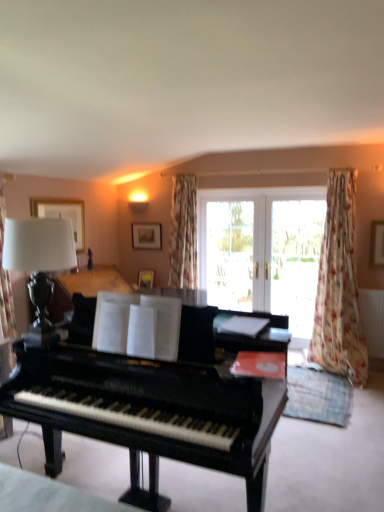
Question: Does white glass doors at center have a greater width compared to transparent glass screen door at center, which is counted as the first screen door, starting from the right?

Choices:
 (A) no
 (B) yes

Answer: (A)

Question: Is the position of white glass doors at center more distant than that of transparent glass screen door at center, the 2th screen door positioned from the left?

Choices:
 (A) yes
 (B) no

Answer: (A)

Question: From the image's perspective, would you say white glass doors at center is positioned over transparent glass screen door at center, which is counted as the first screen door, starting from the right?

Choices:
 (A) no
 (B) yes

Answer: (B)

Question: Can you confirm if white glass doors at center is smaller than transparent glass screen door at center, which is counted as the first screen door, starting from the right?

Choices:
 (A) no
 (B) yes

Answer: (A)

Question: Can you confirm if white glass doors at center is positioned to the right of transparent glass screen door at center, the 2th screen door positioned from the left?

Choices:
 (A) yes
 (B) no

Answer: (B)

Question: Visually, is floral fabric curtain at right positioned to the left or to the right of matte black lamp at left?

Choices:
 (A) right
 (B) left

Answer: (A)

Question: In terms of height, does floral fabric curtain at right look taller or shorter compared to matte black lamp at left?

Choices:
 (A) short
 (B) tall

Answer: (B)

Question: Do you think floral fabric curtain at right is within matte black lamp at left, or outside of it?

Choices:
 (A) outside
 (B) inside

Answer: (A)

Question: Based on their sizes in the image, would you say floral fabric curtain at right is bigger or smaller than matte black lamp at left?

Choices:
 (A) big
 (B) small

Answer: (A)

Question: From the image's perspective, is shiny black piano at center positioned above or below white glass doors at center?

Choices:
 (A) below
 (B) above

Answer: (A)

Question: Is point (135, 417) positioned closer to the camera than point (230, 219)?

Choices:
 (A) farther
 (B) closer

Answer: (B)

Question: Considering the positions of shiny black piano at center and white glass doors at center in the image, is shiny black piano at center taller or shorter than white glass doors at center?

Choices:
 (A) short
 (B) tall

Answer: (A)

Question: In terms of size, does shiny black piano at center appear bigger or smaller than white glass doors at center?

Choices:
 (A) small
 (B) big

Answer: (B)

Question: Does point (324, 338) appear closer or farther from the camera than point (299, 330)?

Choices:
 (A) farther
 (B) closer

Answer: (B)

Question: Based on their positions, is floral fabric curtain at right located to the left or right of transparent glass screen door at center, which is counted as the first screen door, starting from the right?

Choices:
 (A) right
 (B) left

Answer: (A)